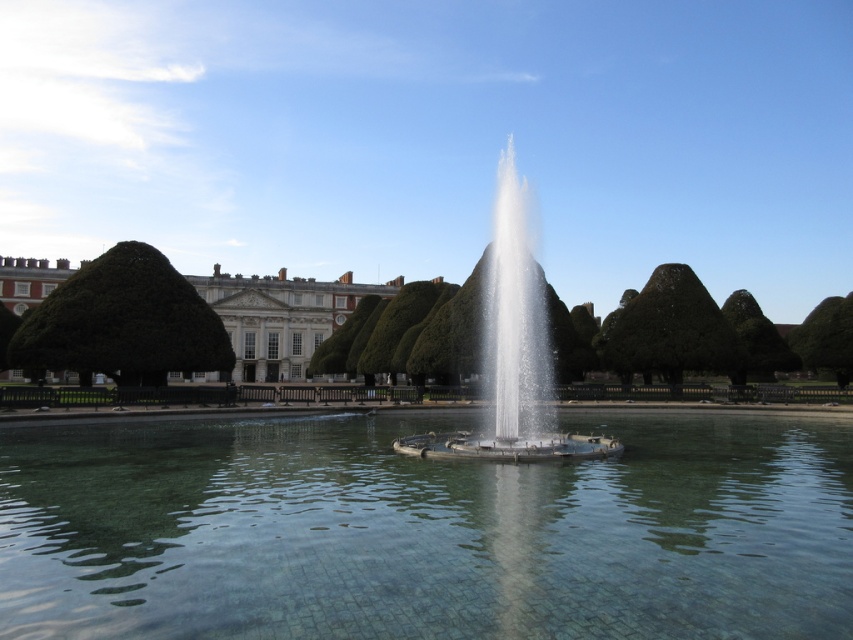
You are standing in the garden facing the fountain and the building. You notice two points marked in the scene. The first point is at coordinate point (20,301) and the second is at point (759,362). Which point is closer to you?

Point (20,301) is further to the camera than point (759,362), so the point closer to you is point (759,362).

You are standing in the garden and want to take a photo of the clear glass fountain at center. There is a green leafy tree at left nearby. Will the tree block the view of the fountain?

The green leafy tree at left is shorter than the clear glass fountain at center, so the tree is not tall enough to block the view of the fountain.

You are standing in the garden and want to find a spot where both the green leafy tree at left and the green leafy tree at upper right are visible. Which tree would you need to position yourself closer to in order to see both?

To see both the green leafy tree at left and the green leafy tree at upper right, you would need to position yourself closer to the green leafy tree at left because it occupies less space and might be smaller, allowing you to see both trees without obstruction.